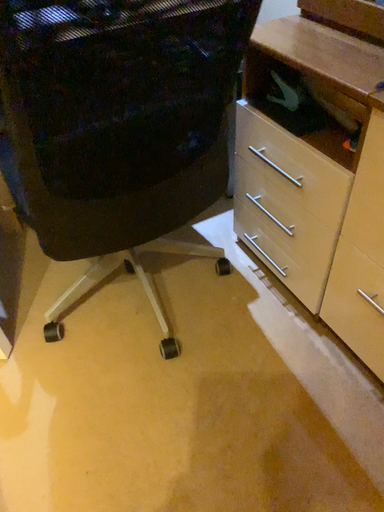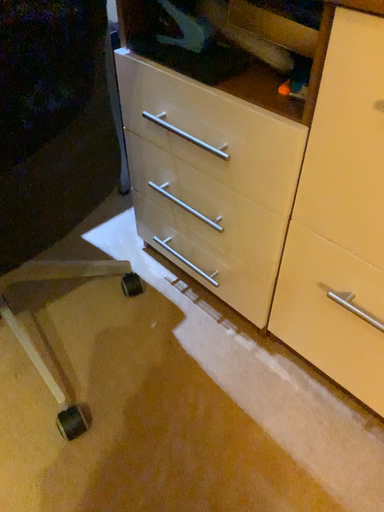
Question: Which way did the camera rotate in the video?

Choices:
 (A) rotated left
 (B) rotated right

Answer: (B)